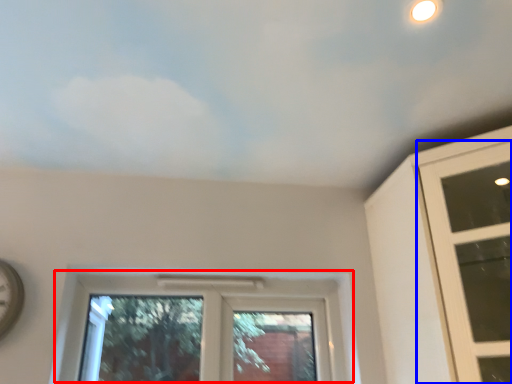
Question: Which point is closer to the camera, window (highlighted by a red box) or window (highlighted by a blue box)?

Choices:
 (A) window
 (B) window

Answer: (B)